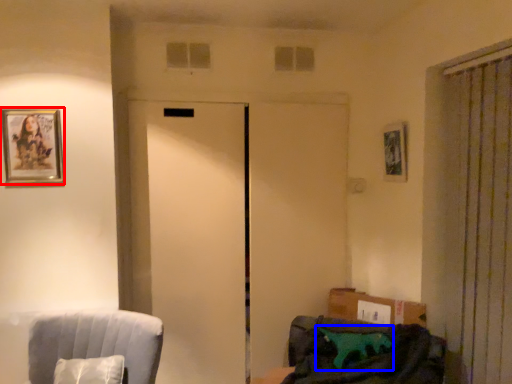
Question: Which object appears closest to the camera in this image, picture frame (highlighted by a red box) or pillow (highlighted by a blue box)?

Choices:
 (A) picture frame
 (B) pillow

Answer: (B)